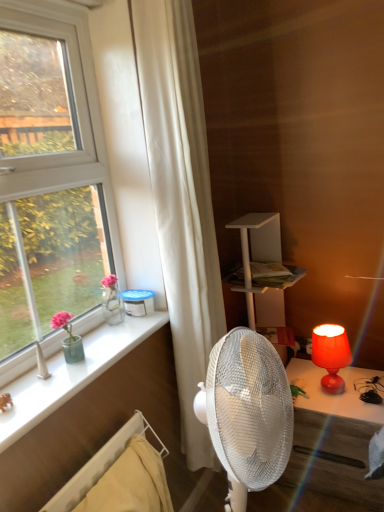
Question: Is matte red lamp at right positioned far away from white fabric curtain at center?

Choices:
 (A) yes
 (B) no

Answer: (B)

Question: Can you confirm if matte red lamp at right is thinner than white fabric curtain at center?

Choices:
 (A) yes
 (B) no

Answer: (A)

Question: Does matte red lamp at right appear on the left side of white fabric curtain at center?

Choices:
 (A) yes
 (B) no

Answer: (B)

Question: Is matte red lamp at right not within white fabric curtain at center?

Choices:
 (A) yes
 (B) no

Answer: (A)

Question: Is matte red lamp at right oriented away from white fabric curtain at center?

Choices:
 (A) yes
 (B) no

Answer: (B)

Question: From a real-world perspective, relative to white glossy window sill at lower left, is matte red lamp at right vertically above or below?

Choices:
 (A) below
 (B) above

Answer: (A)

Question: Would you say matte red lamp at right is to the left or to the right of white glossy window sill at lower left in the picture?

Choices:
 (A) right
 (B) left

Answer: (A)

Question: Is matte red lamp at right taller or shorter than white glossy window sill at lower left?

Choices:
 (A) tall
 (B) short

Answer: (A)

Question: In terms of size, does matte red lamp at right appear bigger or smaller than white glossy window sill at lower left?

Choices:
 (A) small
 (B) big

Answer: (B)

Question: Relative to matte red lamp at right, is white glossy window sill at lower left in front or behind?

Choices:
 (A) front
 (B) behind

Answer: (A)

Question: From their relative heights in the image, would you say white glossy window sill at lower left is taller or shorter than matte red lamp at right?

Choices:
 (A) short
 (B) tall

Answer: (A)

Question: Considering the positions of white glossy window sill at lower left and matte red lamp at right in the image, is white glossy window sill at lower left bigger or smaller than matte red lamp at right?

Choices:
 (A) big
 (B) small

Answer: (B)

Question: Visually, is white glossy window sill at lower left positioned to the left or to the right of matte red lamp at right?

Choices:
 (A) right
 (B) left

Answer: (B)

Question: Is matte red lamp at right in front of or behind white fabric curtain at center in the image?

Choices:
 (A) behind
 (B) front

Answer: (A)

Question: From a real-world perspective, relative to white fabric curtain at center, is matte red lamp at right vertically above or below?

Choices:
 (A) below
 (B) above

Answer: (A)